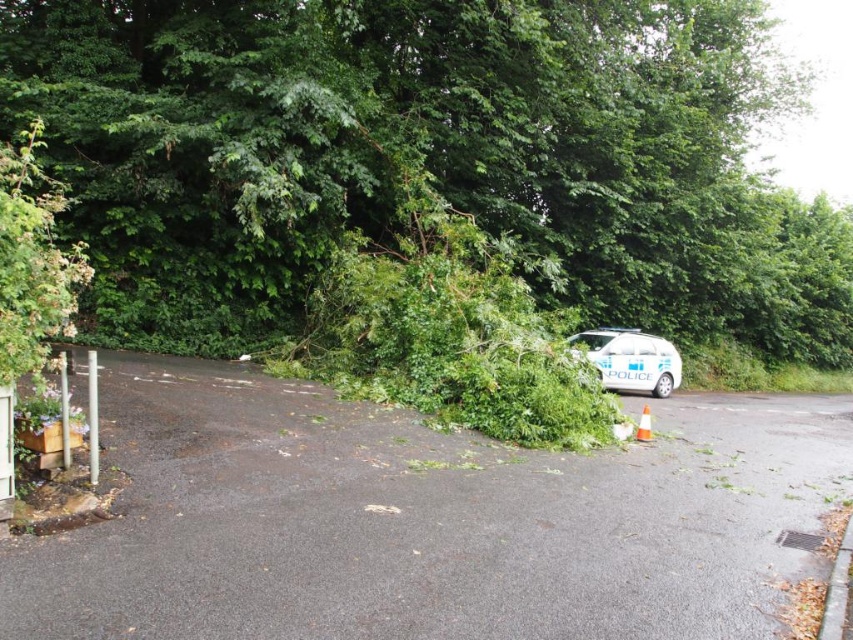
You are a driver approaching the green leafy tree at center and the white metallic police car at center. Which object is larger in size?

The green leafy tree at center is bigger than the white metallic police car at center.

You are a driver approaching the road with the green leafy tree at center and the white metallic police car at center. Can your car pass through the road without hitting the tree or the police car? Explain your reasoning based on their sizes.

The green leafy tree at center is wider than the white metallic police car at center. Since the tree is blocking the road and its width is greater than the police car, it is likely that the road is obstructed, making it unsafe to pass through without hitting the tree or the police car.

You are a pedestrian trying to cross the road where the green leafy tree at center and white metallic police car at center are located. Which object is closer to you as you approach the road?

The green leafy tree at center is closer to you than the white metallic police car at center.